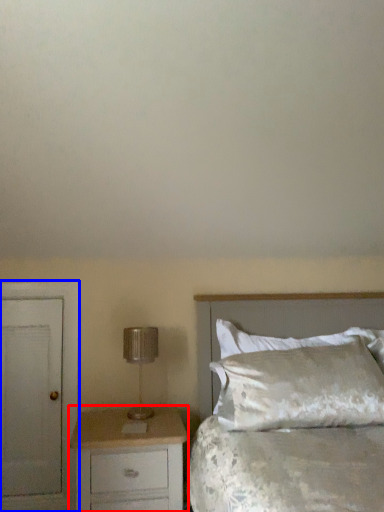
Question: Among these objects, which one is farthest to the camera, chest of drawers (highlighted by a red box) or armoire (highlighted by a blue box)?

Choices:
 (A) chest of drawers
 (B) armoire

Answer: (B)